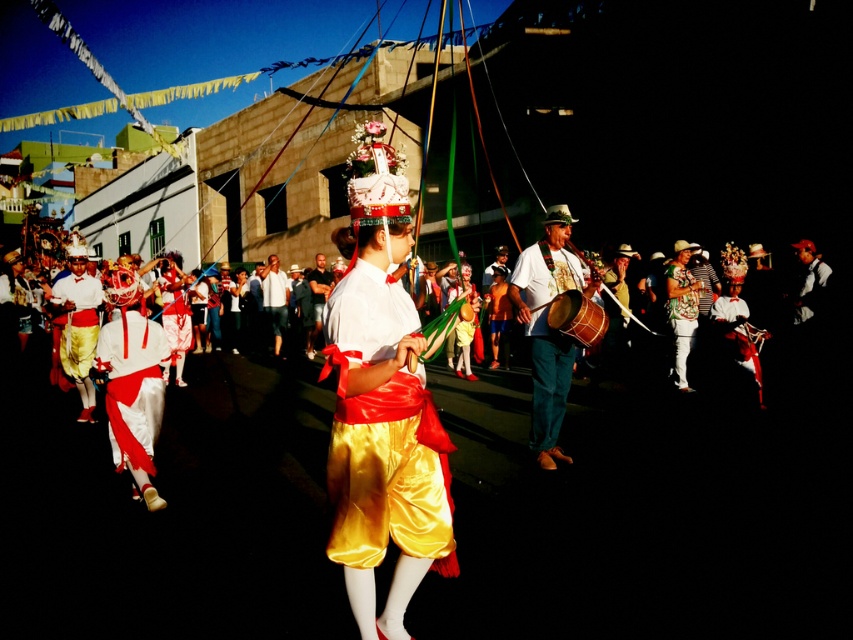
Question: From the image, what is the correct spatial relationship of shiny gold shorts at center in relation to shiny green fabric at center?

Choices:
 (A) below
 (B) above

Answer: (A)

Question: Which object appears closest to the camera in this image?

Choices:
 (A) shiny gold shorts at center
 (B) white satin shorts at center
 (C) matte brown drum at center

Answer: (A)

Question: Which of these objects is positioned farthest from the white satin pants at left?

Choices:
 (A) shiny gold shorts at center
 (B) shiny green fabric at center

Answer: (B)

Question: Estimate the real-world distances between objects in this image. Which object is farther from the white satin shorts at center?

Choices:
 (A) silky gold shorts at center
 (B) wooden drum at center
 (C) shiny green fabric at center

Answer: (A)

Question: Can you confirm if shiny gold shorts at center is positioned above white satin shorts at center?

Choices:
 (A) no
 (B) yes

Answer: (A)

Question: Is shiny gold shorts at center wider than wooden drum at center?

Choices:
 (A) yes
 (B) no

Answer: (A)